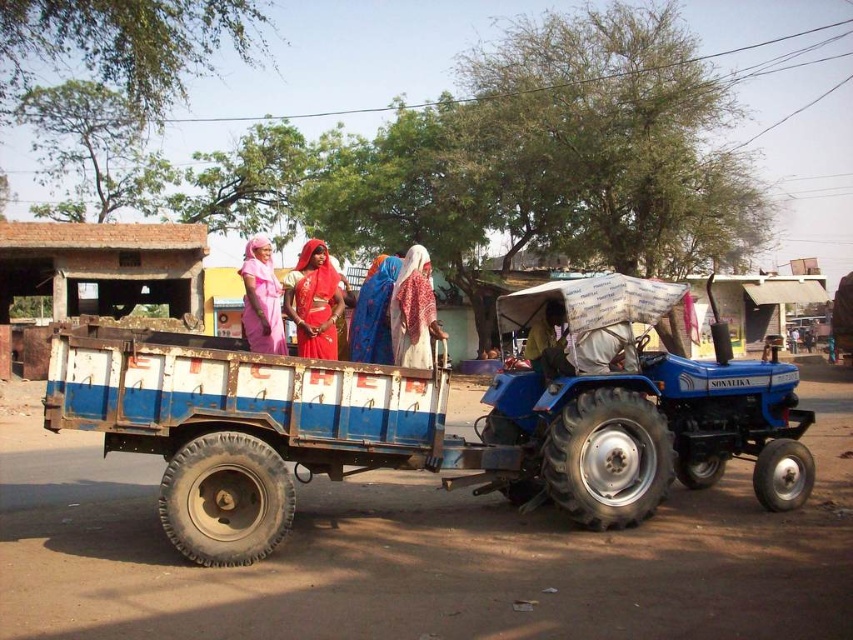
Question: Which of these objects is positioned farthest from the blue fabric at center?

Choices:
 (A) matte pink dress at center
 (B) blue metallic tractor at center
 (C) matte red sari at center
 (D) white cotton dress at center

Answer: (A)

Question: Which point appears farthest from the camera in this image?

Choices:
 (A) (379, 305)
 (B) (173, 346)
 (C) (265, 342)

Answer: (A)

Question: Does blue metallic tractor at center have a lesser width compared to matte red sari at center?

Choices:
 (A) yes
 (B) no

Answer: (B)

Question: Is matte pink dress at center above blue fabric at center?

Choices:
 (A) yes
 (B) no

Answer: (A)

Question: Observing the image, what is the correct spatial positioning of matte red sari at center in reference to white cotton dress at center?

Choices:
 (A) right
 (B) left

Answer: (B)

Question: Which point appears closest to the camera in this image?

Choices:
 (A) (425, 289)
 (B) (386, 300)

Answer: (A)